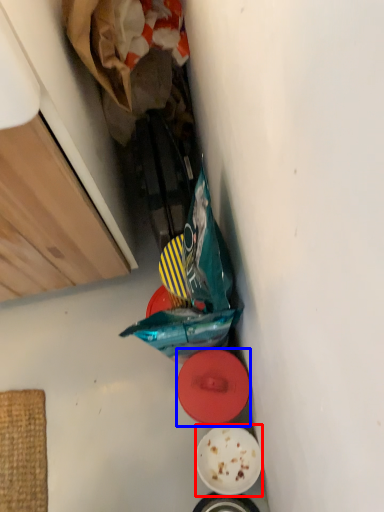
Question: Which of the following is the farthest to the observer, plate (highlighted by a red box) or plate (highlighted by a blue box)?

Choices:
 (A) plate
 (B) plate

Answer: (A)